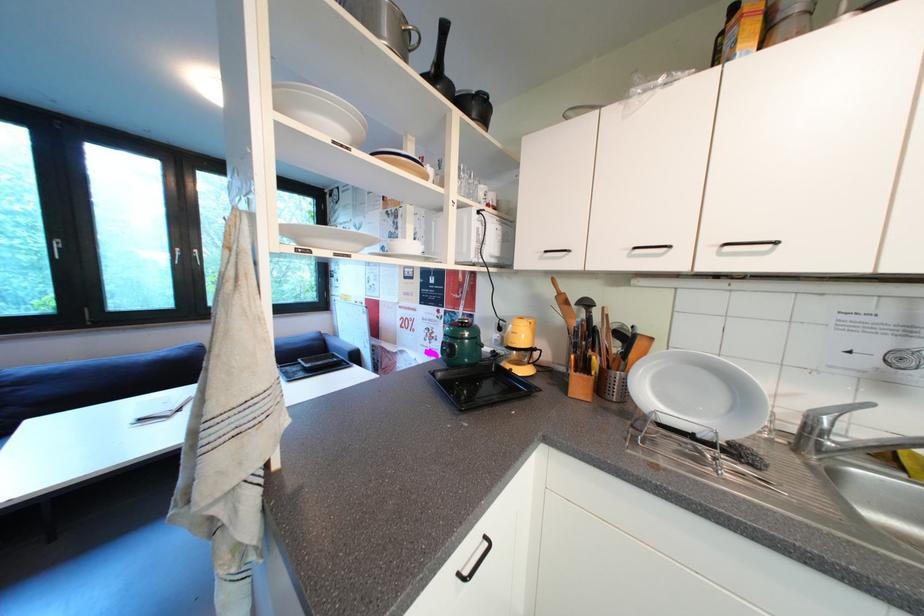
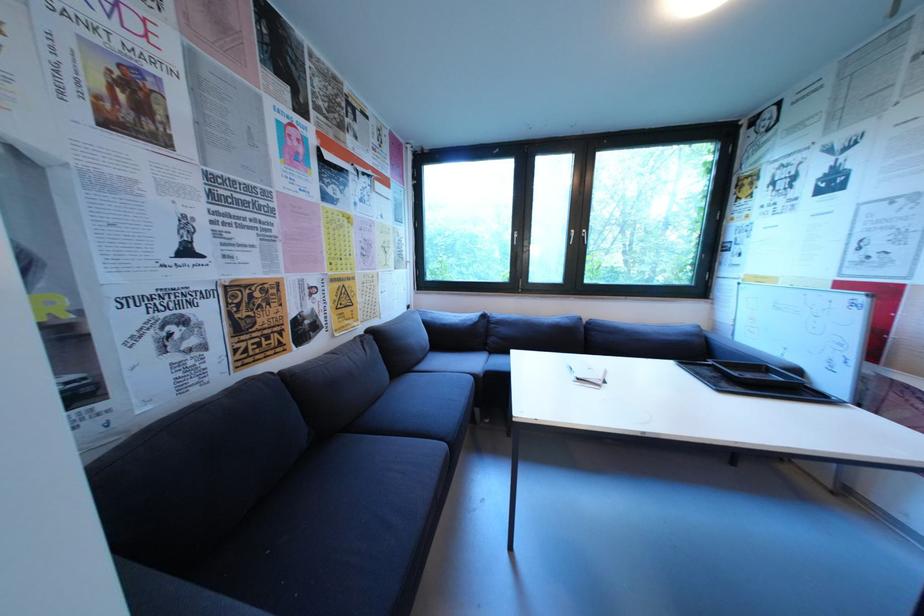
Locate, in the second image, the point that corresponds to (149,422) in the first image.

(586, 381)